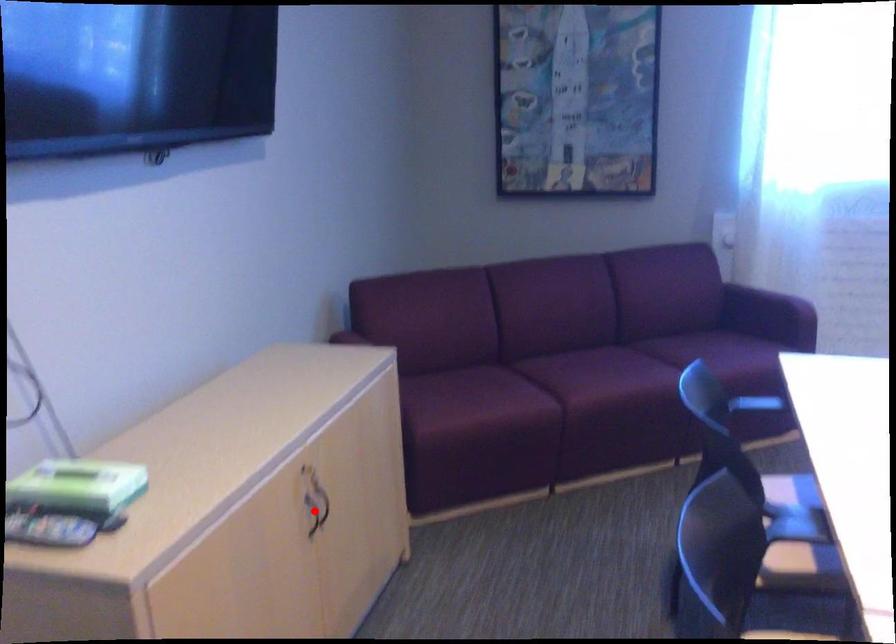
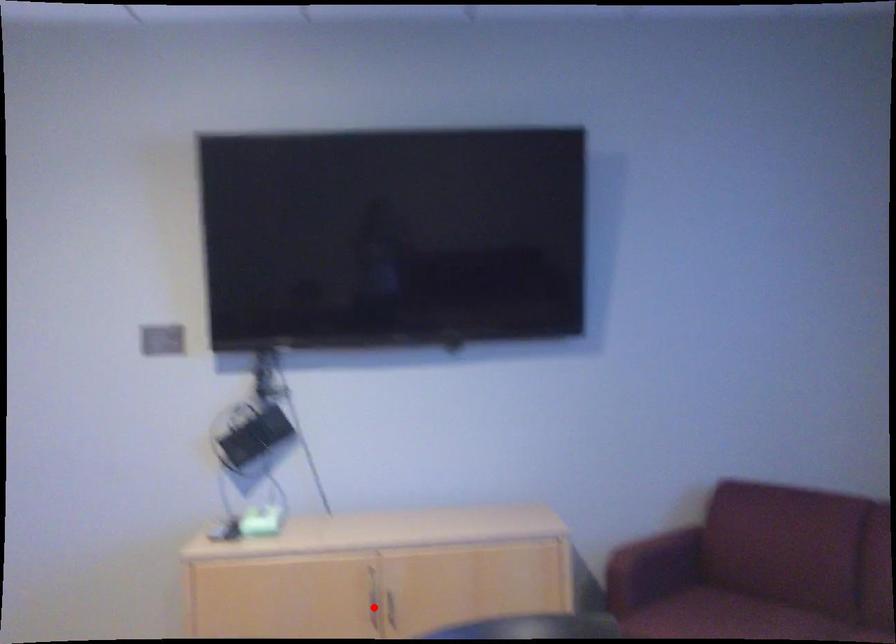
I am providing you with two images of the same scene from different viewpoints. A red point is marked on the first image and another point is marked on the second image. Is the red point in image1 aligned with the point shown in image2?

Yes